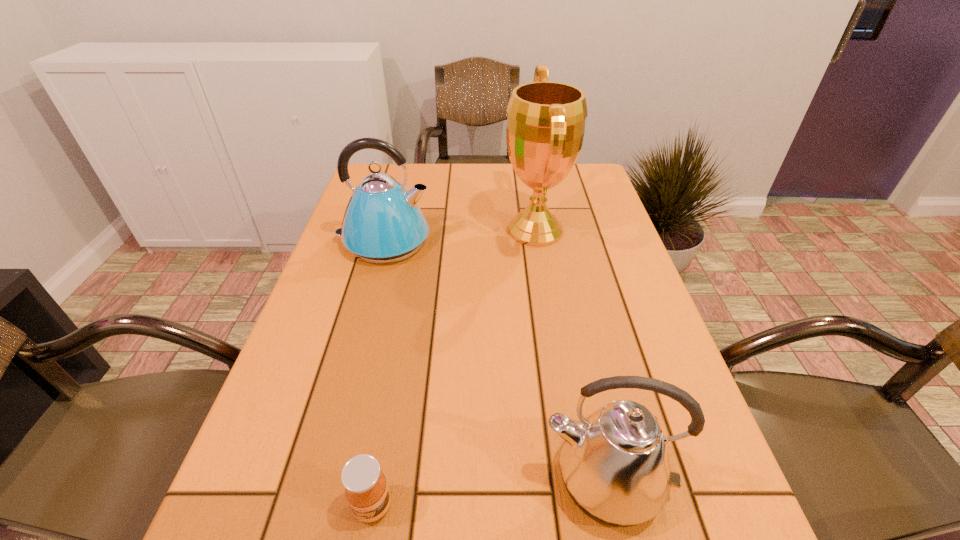
In order to click on object that is at the left edge in this screenshot , I will do `click(383, 223)`.

Locate an element on the screen. award that is positioned at the right edge is located at coordinates (545, 128).

Identify the location of kettle that is at the right edge. The height and width of the screenshot is (540, 960). (615, 465).

Identify the location of object present at the far right corner. The height and width of the screenshot is (540, 960). (545, 128).

At what (x,y) coordinates should I click in order to perform the action: click on vacant space at the far edge. Please return your answer as a coordinate pair (x, y). Looking at the image, I should click on [461, 199].

The image size is (960, 540). In the image, there is a desktop. What are the coordinates of `free space at the left edge` in the screenshot? It's located at (323, 311).

At what (x,y) coordinates should I click in order to perform the action: click on free space at the right edge of the desktop. Please return your answer as a coordinate pair (x, y). Looking at the image, I should click on (642, 311).

This screenshot has height=540, width=960. Find the location of `vacant area between the nearer kettle and the farther kettle`. vacant area between the nearer kettle and the farther kettle is located at coordinates (494, 361).

Find the location of a particular element. empty location between the right kettle and the award is located at coordinates (570, 355).

This screenshot has width=960, height=540. I want to click on unoccupied position between the left kettle and the nearer kettle, so click(494, 361).